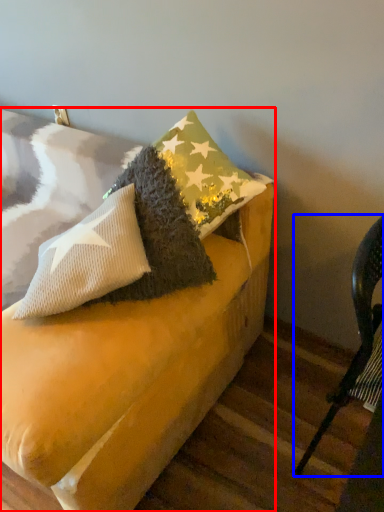
Question: Which of the following is the closest to the observer, furniture (highlighted by a red box) or chair (highlighted by a blue box)?

Choices:
 (A) furniture
 (B) chair

Answer: (B)